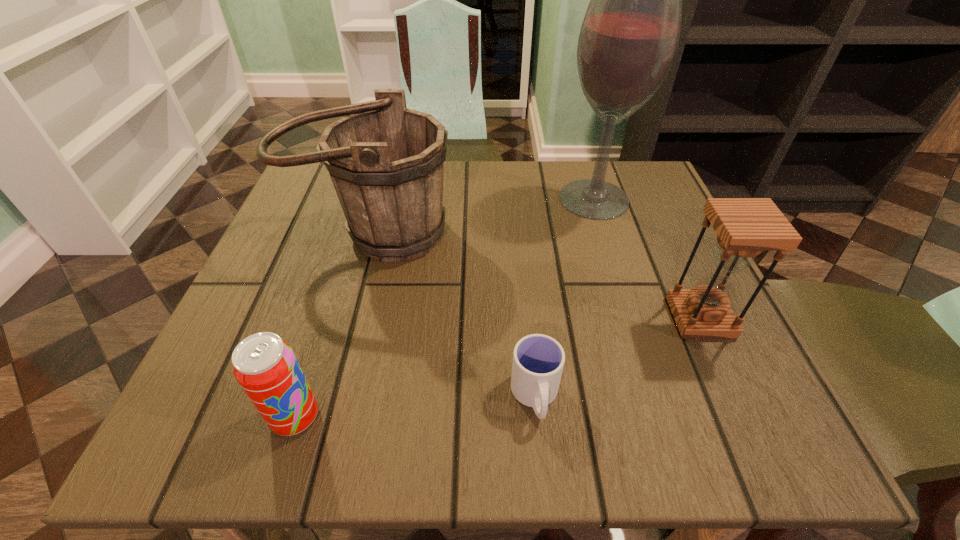
This screenshot has width=960, height=540. What are the coordinates of `the fourth closest object to the cup` in the screenshot? It's located at (629, 37).

Identify the location of vacant area that satisfies the following two spatial constraints: 1. on the back side of the third shortest object; 2. on the right side of the second shortest object. (327, 318).

You are a GUI agent. You are given a task and a screenshot of the screen. Output one action in this format:
    pyautogui.click(x=<x>, y=<y>)
    Task: Click on the vacant position in the image that satisfies the following two spatial constraints: 1. on the handle side of the bucket; 2. on the right side of the third nearest object
    
    Given the screenshot: What is the action you would take?
    pyautogui.click(x=349, y=318)